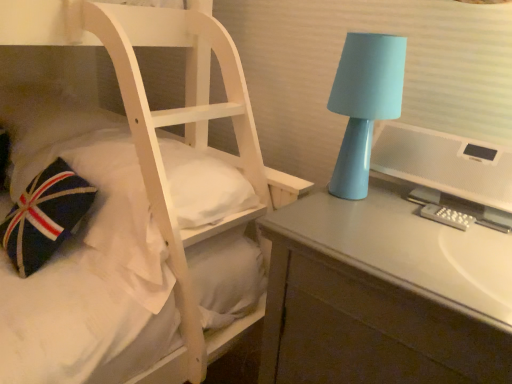
Image resolution: width=512 pixels, height=384 pixels. What are the coordinates of `vacant space that's between matte blue lamp at right and white textured computer monitor at right` in the screenshot? It's located at (418, 221).